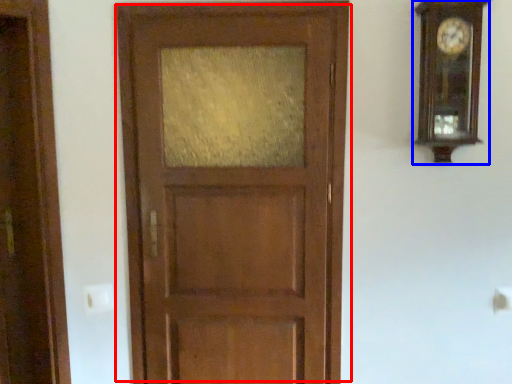
Question: Which of the following is the farthest to the observer, door (highlighted by a red box) or clock (highlighted by a blue box)?

Choices:
 (A) door
 (B) clock

Answer: (A)